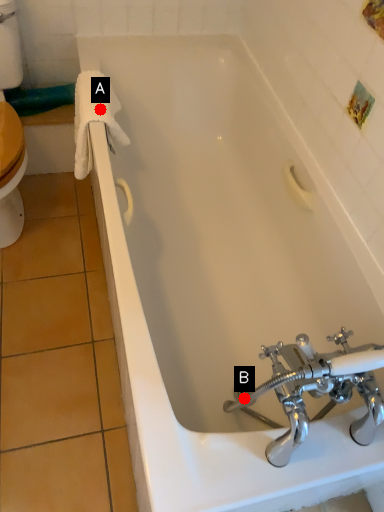
Question: Two points are circled on the image, labeled by A and B beside each circle. Which of the following is the closest to the observer?

Choices:
 (A) A is closer
 (B) B is closer

Answer: (B)